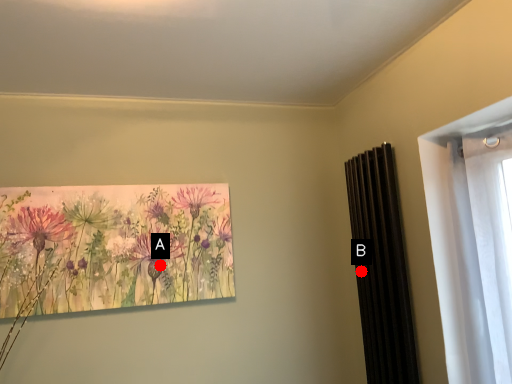
Question: Two points are circled on the image, labeled by A and B beside each circle. Which point is farther from the camera taking this photo?

Choices:
 (A) A is further
 (B) B is further

Answer: (B)